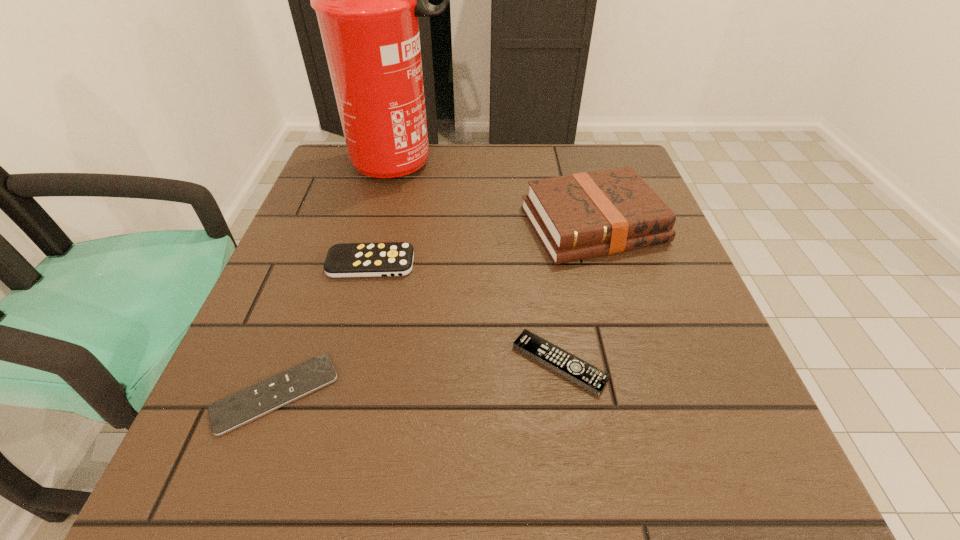
Locate an element on the screen. vacant space located 0.320m on the front of the farthest remote control is located at coordinates [325, 443].

Locate an element on the screen. This screenshot has width=960, height=540. vacant space positioned 0.100m on the back of the second shortest object is located at coordinates (548, 291).

Where is `vacant space positioned on the right of the shortest object`? The width and height of the screenshot is (960, 540). vacant space positioned on the right of the shortest object is located at coordinates (472, 394).

The width and height of the screenshot is (960, 540). In order to click on fire extinguisher at the far edge in this screenshot , I will do `click(367, 0)`.

Locate an element on the screen. This screenshot has height=540, width=960. hardback book that is positioned at the far edge is located at coordinates (583, 215).

Locate an element on the screen. This screenshot has height=540, width=960. fire extinguisher situated at the left edge is located at coordinates (367, 0).

Identify the location of object positioned at the right edge. This screenshot has width=960, height=540. point(583,215).

Identify the location of object at the far left corner. (367, 0).

Where is `object that is at the far right corner`? object that is at the far right corner is located at coordinates (583, 215).

Locate an element on the screen. The width and height of the screenshot is (960, 540). vacant space at the far edge of the desktop is located at coordinates (436, 185).